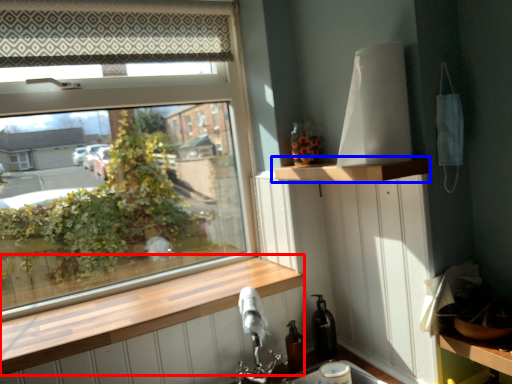
Question: Which object is closer to the camera taking this photo, window sill (highlighted by a red box) or shelf (highlighted by a blue box)?

Choices:
 (A) window sill
 (B) shelf

Answer: (B)